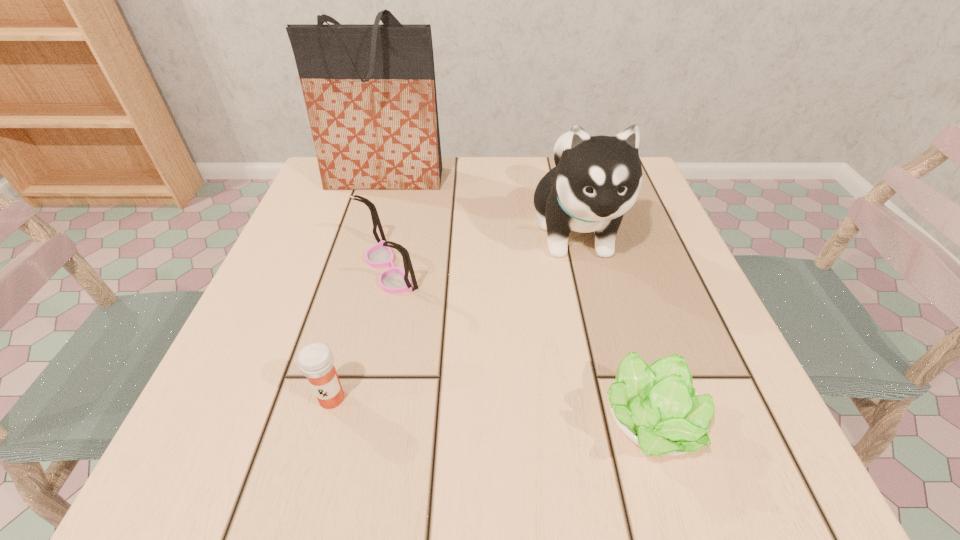
This screenshot has width=960, height=540. I want to click on free spot between the lettuce and the medicine, so [490, 411].

Where is `free space between the medicine and the tallest object`? free space between the medicine and the tallest object is located at coordinates (358, 289).

This screenshot has width=960, height=540. In order to click on free spot between the tallest object and the puppy in this screenshot , I will do `click(480, 205)`.

I want to click on vacant space that's between the shortest object and the second tallest object, so click(x=612, y=327).

What are the coordinates of `free space between the second shortest object and the spectacles` in the screenshot? It's located at (361, 334).

Where is `object that is the third closest to the tallest object`? object that is the third closest to the tallest object is located at coordinates (316, 362).

Identify the location of the fourth closest object to the shortest object. This screenshot has height=540, width=960. (370, 93).

Find the location of `vacant space that satisfies the following two spatial constraints: 1. on the front-facing side of the shopping bag; 2. on the left side of the lettuce`. vacant space that satisfies the following two spatial constraints: 1. on the front-facing side of the shopping bag; 2. on the left side of the lettuce is located at coordinates (314, 424).

Identify the location of vacant space that satisfies the following two spatial constraints: 1. on the label side of the second shortest object; 2. on the left side of the lettuce. This screenshot has height=540, width=960. 324,424.

Where is `free space that satisfies the following two spatial constraints: 1. on the front-facing side of the shopping bag; 2. on the right side of the shortest object`? This screenshot has height=540, width=960. free space that satisfies the following two spatial constraints: 1. on the front-facing side of the shopping bag; 2. on the right side of the shortest object is located at coordinates (314, 424).